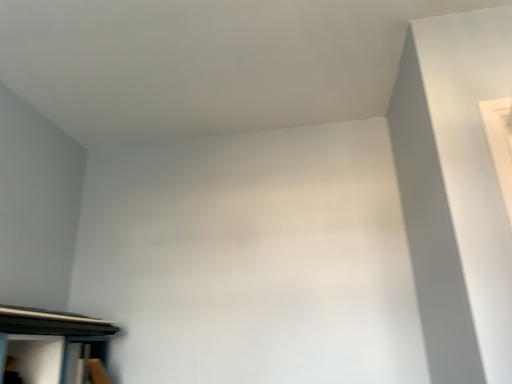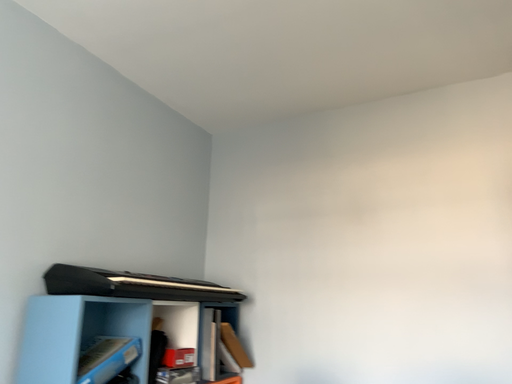
Question: Which way did the camera rotate in the video?

Choices:
 (A) rotated left
 (B) rotated right

Answer: (A)